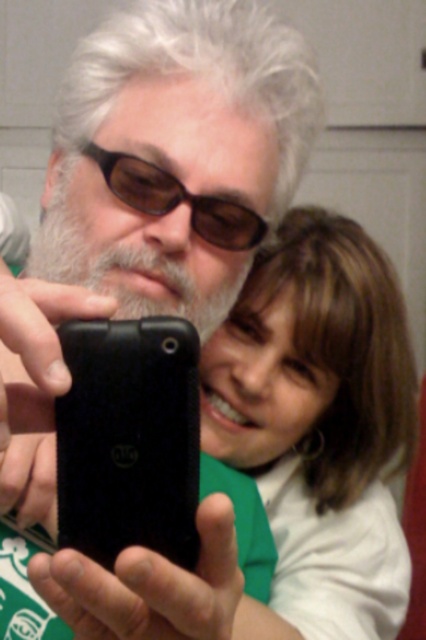
You are a photographer trying to capture a clear selfie of both the black matte smartphone at center and the brown matte sunglasses at center. Given that your camera has a minimum focus distance of 10 inches, will you be able to take the photo without moving the objects?

The black matte smartphone at center and the brown matte sunglasses at center are 8.62 inches apart from each other. Since the minimum focus distance of your camera is 10 inches, the objects are too close together to be captured clearly without moving them.

You are a photographer trying to capture a selfie with two people. The older person in the foreground is holding the camera, and the person in the background has shoulder length brown hair. The camera is at point (x=187, y=237). If the distance between the camera and the point is 18.41 inches, will the background person be in focus?

The point (x=187, y=237) and camera are 18.41 inches apart. Since the background person is farther away from the camera than the point, they will not be in focus.

You are trying to take a selfie with the black matte smartphone at center and the brown matte sunglasses at center. Since the phone is much taller than the sunglasses, which object would you need to hold higher to ensure both are fully visible in the photo?

The black matte smartphone at center is much taller than the brown matte sunglasses at center. To ensure both are fully visible in the photo, you would need to hold the black matte smartphone at center higher since it is taller and might otherwise be cut off at the bottom or top of the frame.